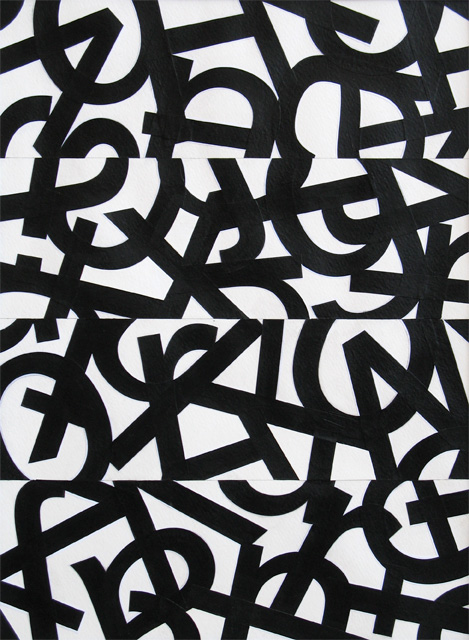
At what (x,y) coordinates should I click in order to perform the action: click on the bottom of art. Please return your answer as a coordinate pair (x, y). This screenshot has height=640, width=469. Looking at the image, I should click on (250, 637).